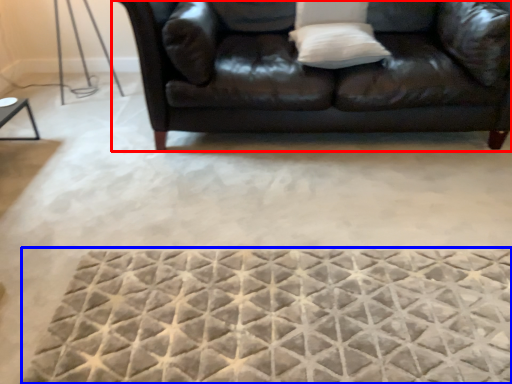
Question: Which object appears farthest to the camera in this image, studio couch (highlighted by a red box) or mat (highlighted by a blue box)?

Choices:
 (A) studio couch
 (B) mat

Answer: (A)